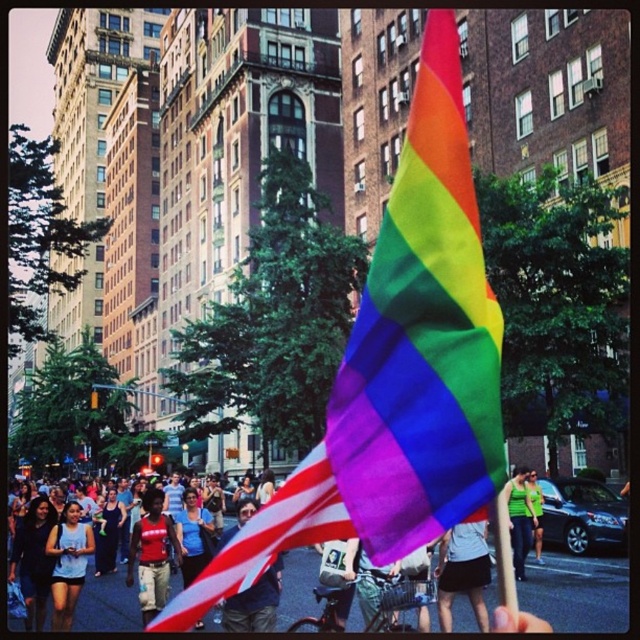
Question: Based on their relative distances, which object is farther from the green fabric shirt at center?

Choices:
 (A) american flag at center
 (B) rainbow fabric flag at center
 (C) white cotton shirt at center
 (D) black fabric dress at lower left

Answer: (D)

Question: Considering the relative positions of american flag at center and green fabric shirt at center in the image provided, where is american flag at center located with respect to green fabric shirt at center?

Choices:
 (A) below
 (B) above

Answer: (A)

Question: Which object appears farthest from the camera in this image?

Choices:
 (A) rainbow fabric flag at center
 (B) black fabric dress at lower left

Answer: (B)

Question: Is american flag at center above green fabric tank top at center?

Choices:
 (A) no
 (B) yes

Answer: (B)

Question: Considering the real-world distances, which object is farthest from the black fabric dress at lower left?

Choices:
 (A) red fabric shirt at center
 (B) green fabric tank top at center
 (C) green fabric shirt at center
 (D) white cotton shirt at center

Answer: (C)

Question: Does white cotton shirt at center have a lesser width compared to light blue fabric tank top at center?

Choices:
 (A) no
 (B) yes

Answer: (B)